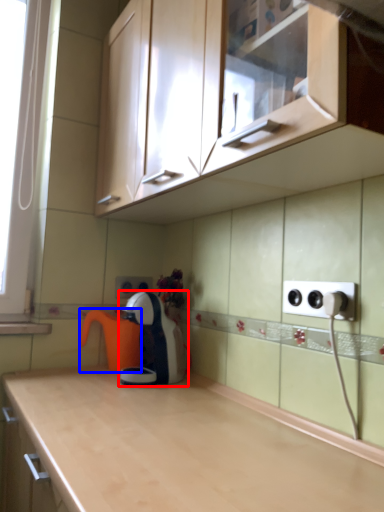
Question: Which point is closer to the camera, home appliance (highlighted by a red box) or coffeepot (highlighted by a blue box)?

Choices:
 (A) home appliance
 (B) coffeepot

Answer: (A)